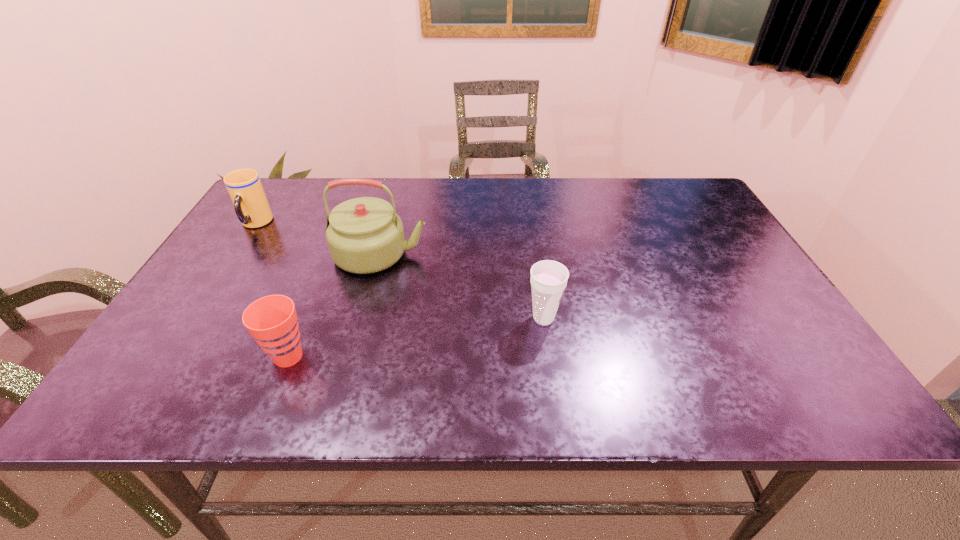
Image resolution: width=960 pixels, height=540 pixels. Identify the location of kettle. (365, 235).

Locate an element on the screen. the leftmost cup is located at coordinates (x=244, y=186).

Locate an element on the screen. the leftmost object is located at coordinates (244, 186).

Locate an element on the screen. the second nearest object is located at coordinates (548, 280).

Identify the location of the rightmost object. Image resolution: width=960 pixels, height=540 pixels. (548, 280).

This screenshot has height=540, width=960. Identify the location of the second cup from right to left. (272, 320).

The height and width of the screenshot is (540, 960). I want to click on the nearest cup, so click(x=272, y=320).

The width and height of the screenshot is (960, 540). What are the coordinates of `free location located at the spout of the tallest object` in the screenshot? It's located at (475, 254).

This screenshot has height=540, width=960. I want to click on free space located on the side of the farthest cup with the handle, so click(218, 282).

The image size is (960, 540). In order to click on free space located on the front of the second nearest cup in this screenshot , I will do `click(552, 374)`.